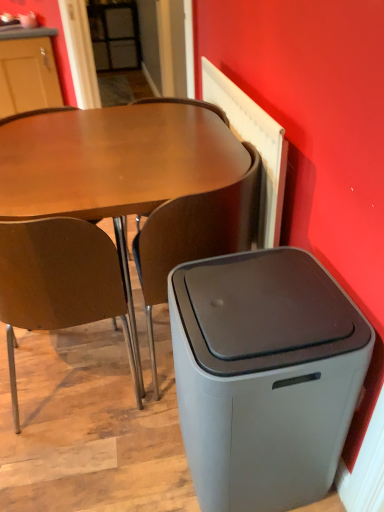
At what (x,y) coordinates should I click in order to perform the action: click on free space in front of brown wood chair at left, which is the second chair in right-to-left order. Please return your answer as a coordinate pair (x, y). This screenshot has width=384, height=512. Looking at the image, I should click on (86, 460).